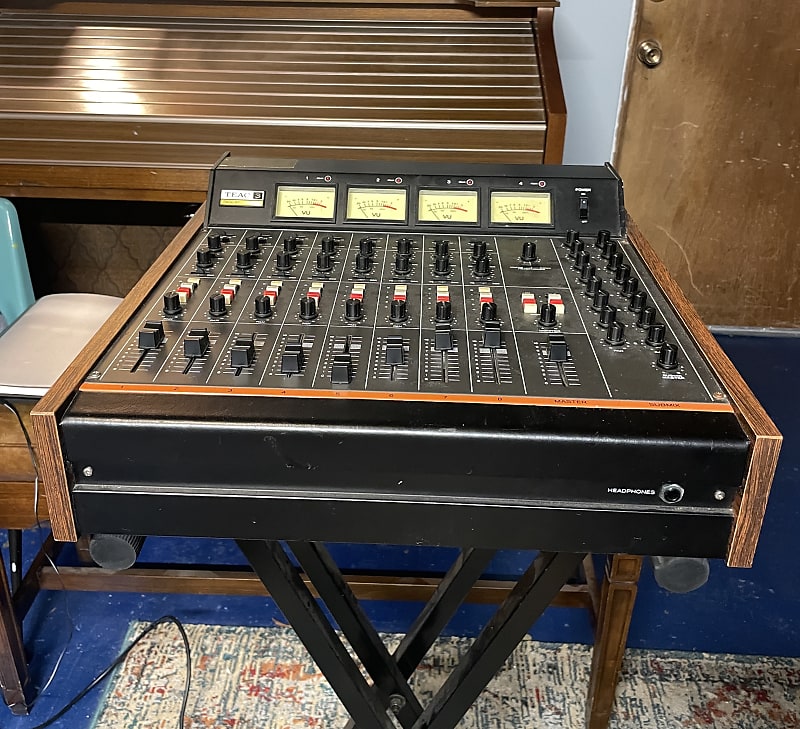
Where is `wooden door`? This screenshot has height=729, width=800. wooden door is located at coordinates (682, 105).